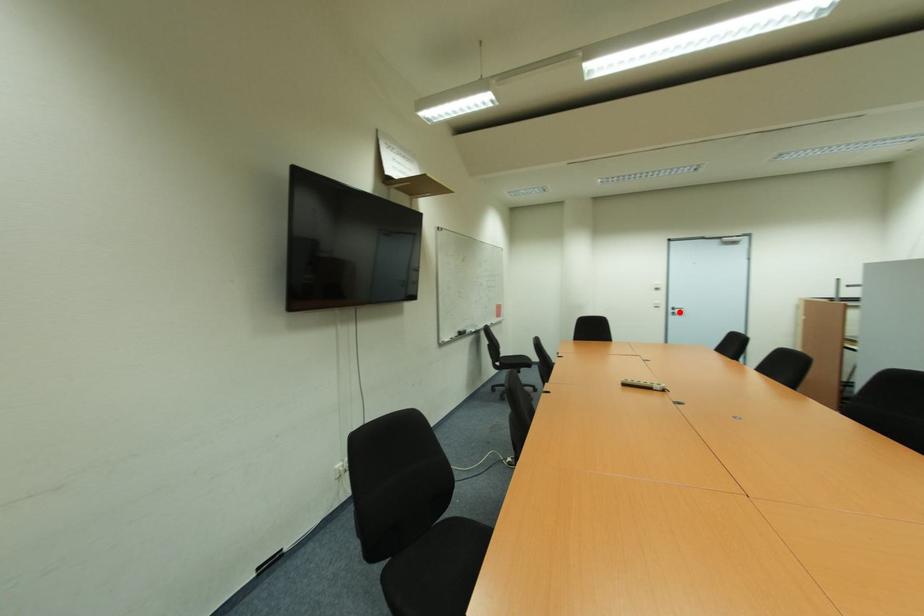
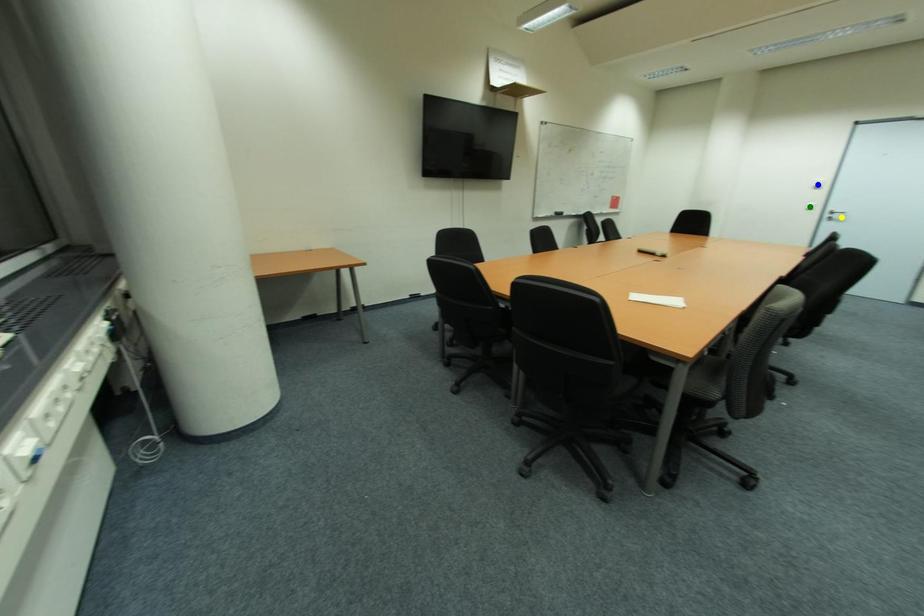
Question: I am providing you with two images of the same scene from different viewpoints. A red point is marked on the first image. You are given multiple points on the second image. Can you choose the point in image 2 that corresponds to the point in image 1?

Choices:
 (A) blue point
 (B) yellow point
 (C) green point

Answer: (B)